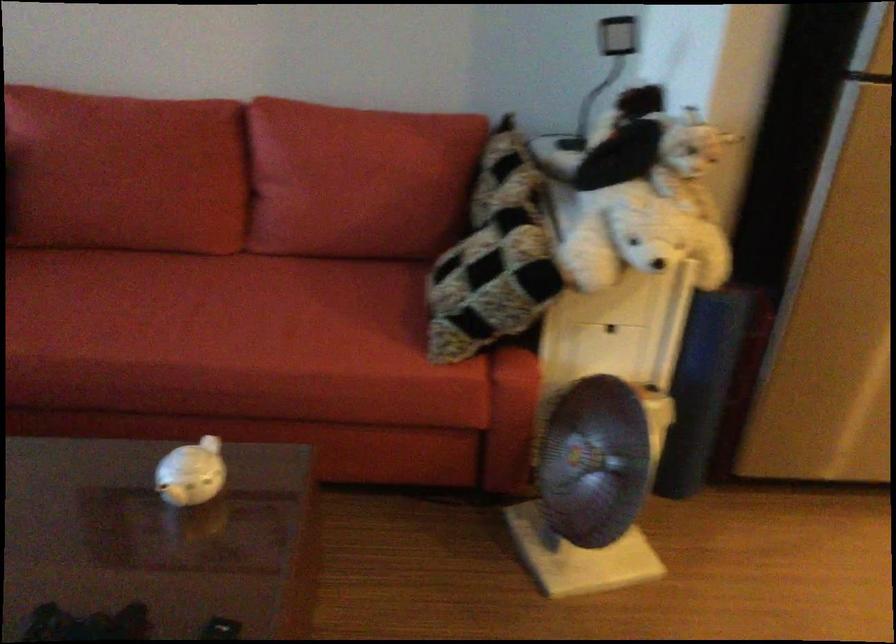
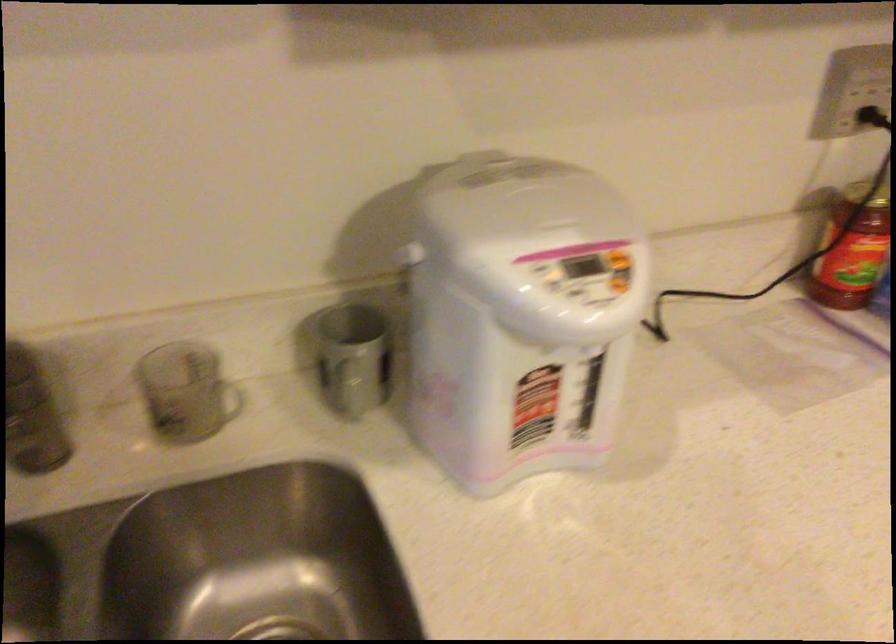
In the scene shown: The images are taken continuously from a first-person perspective. In which direction are you moving?

The cameraman walked toward right, forward.